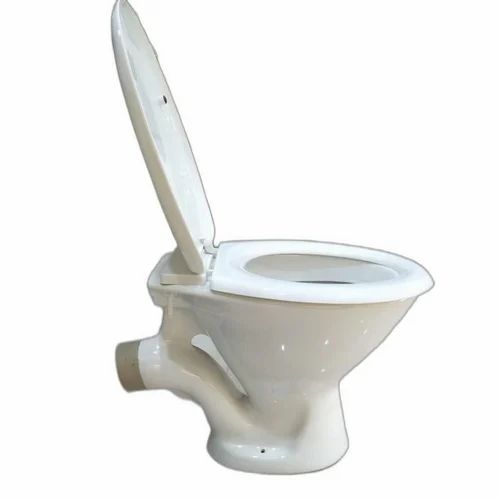
You are a GUI agent. You are given a task and a screenshot of the screen. Output one action in this format:
    pyautogui.click(x=<x>, y=<y>)
    Task: Click on the inner toilet wall
    Image resolution: width=500 pixels, height=500 pixels.
    Given the screenshot: What is the action you would take?
    pyautogui.click(x=301, y=262)